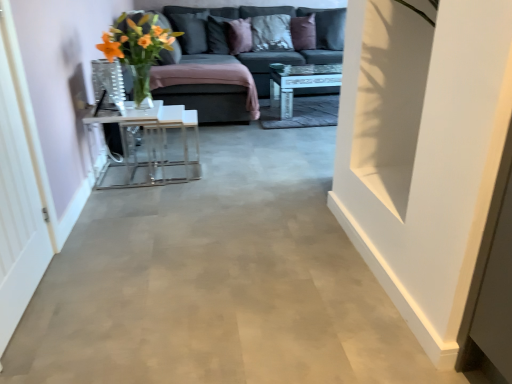
Question: Is purple velvet pillow at upper center, marked as the first pillow in a right-to-left arrangement, smaller than white matte door at right?

Choices:
 (A) yes
 (B) no

Answer: (A)

Question: Considering the relative sizes of purple velvet pillow at upper center, which is the fifth pillow in left-to-right order, and white matte door at right in the image provided, is purple velvet pillow at upper center, which is the fifth pillow in left-to-right order, wider than white matte door at right?

Choices:
 (A) yes
 (B) no

Answer: (A)

Question: Is purple velvet pillow at upper center, which is the fifth pillow in left-to-right order, positioned behind white matte door at right?

Choices:
 (A) no
 (B) yes

Answer: (B)

Question: Considering the relative sizes of purple velvet pillow at upper center, which is the fifth pillow in left-to-right order, and white matte door at right in the image provided, is purple velvet pillow at upper center, which is the fifth pillow in left-to-right order, thinner than white matte door at right?

Choices:
 (A) yes
 (B) no

Answer: (B)

Question: From a real-world perspective, is purple velvet pillow at upper center, which is the fifth pillow in left-to-right order, positioned under white matte door at right based on gravity?

Choices:
 (A) no
 (B) yes

Answer: (A)

Question: Is white matte door at right located within purple velvet pillow at upper center, marked as the first pillow in a right-to-left arrangement?

Choices:
 (A) yes
 (B) no

Answer: (B)

Question: Is purple velvet pillow at upper center, marked as the first pillow in a right-to-left arrangement, turned away from transparent glass door at left?

Choices:
 (A) yes
 (B) no

Answer: (B)

Question: Is the position of purple velvet pillow at upper center, which is the fifth pillow in left-to-right order, more distant than that of transparent glass door at left?

Choices:
 (A) yes
 (B) no

Answer: (A)

Question: Does purple velvet pillow at upper center, marked as the first pillow in a right-to-left arrangement, lie in front of transparent glass door at left?

Choices:
 (A) yes
 (B) no

Answer: (B)

Question: From the image's perspective, is purple velvet pillow at upper center, marked as the first pillow in a right-to-left arrangement, located beneath transparent glass door at left?

Choices:
 (A) no
 (B) yes

Answer: (A)

Question: Is purple velvet pillow at upper center, marked as the first pillow in a right-to-left arrangement, shorter than transparent glass door at left?

Choices:
 (A) no
 (B) yes

Answer: (B)

Question: Does purple velvet pillow at upper center, marked as the first pillow in a right-to-left arrangement, have a smaller size compared to transparent glass door at left?

Choices:
 (A) yes
 (B) no

Answer: (B)

Question: Is the depth of textured gray pillow at upper center, which is counted as the 4th pillow, starting from the left, less than that of purple velvet pillow at upper center, the third pillow positioned from the left?

Choices:
 (A) yes
 (B) no

Answer: (B)